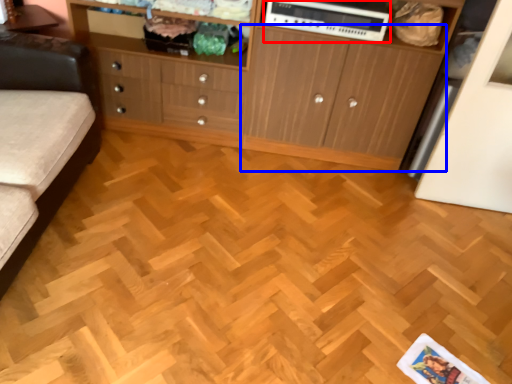
Question: Which point is further to the camera, appliance (highlighted by a red box) or cupboard (highlighted by a blue box)?

Choices:
 (A) appliance
 (B) cupboard

Answer: (A)